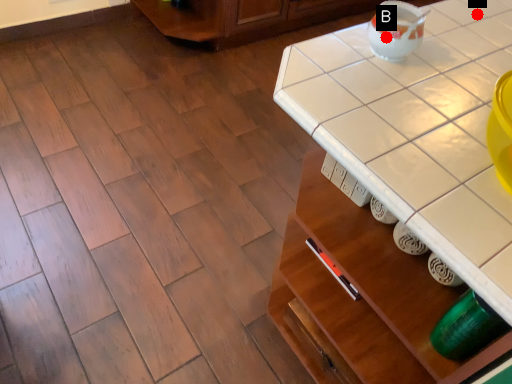
Question: Two points are circled on the image, labeled by A and B beside each circle. Which point is closer to the camera taking this photo?

Choices:
 (A) A is closer
 (B) B is closer

Answer: (B)